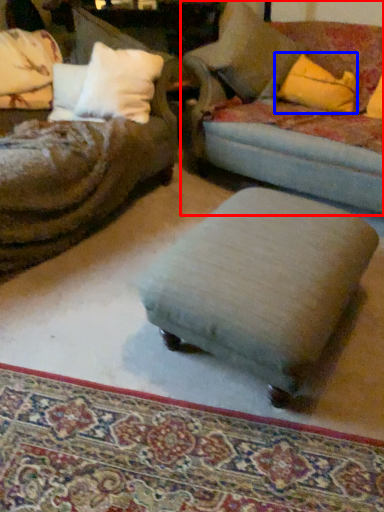
Question: Which point is further to the camera, studio couch (highlighted by a red box) or throw pillow (highlighted by a blue box)?

Choices:
 (A) studio couch
 (B) throw pillow

Answer: (B)